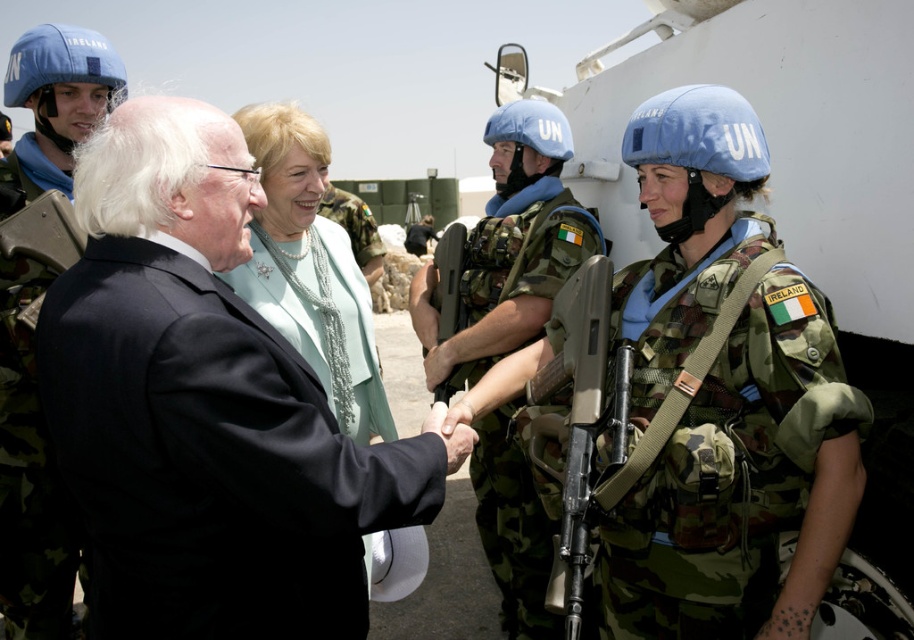
You are a photographer at the scene. You need to capture a photo where both the camouflage uniform at center and the blue helmet at upper left are clearly visible. Based on their positions, which object should you adjust your camera focus to first to ensure both are in frame?

The blue helmet at upper left should be focused on first since the camouflage uniform at center is to the right of it, allowing the photographer to adjust the camera to include both objects in the frame by expanding the field of view from the left to the right.